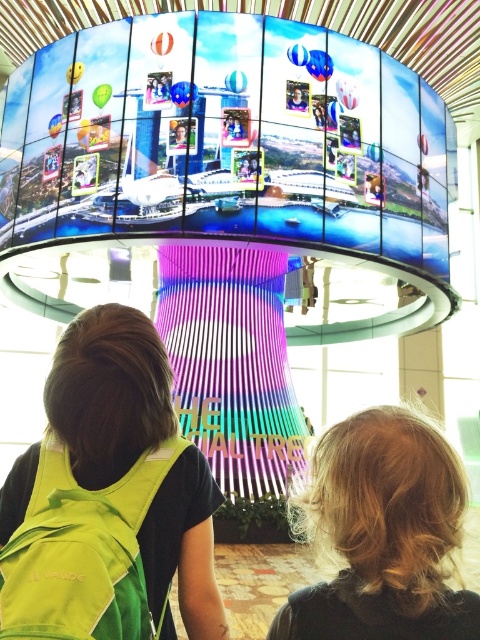
You are a photographer holding a camera and want to capture a closeup shot of the blonde hair at upper right without any obstructions. Given that your camera has a minimum focusing distance of 30 inches, will you be able to take the photo?

The blonde hair at upper right and camera are 32.76 inches apart from each other. Since the minimum focusing distance is 30 inches, the camera can focus at 32.76 inches, so yes, you can take the closeup shot.

You are an event coordinator planning to place a new promotional banner between the blonde hair at upper right and the green fabric safety vest at lower left. Based on their sizes, which object should the banner be closer to?

The banner should be closer to the green fabric safety vest at lower left because the blonde hair at upper right occupies less space, meaning the green fabric safety vest at lower left is larger and would require more proximity for visibility.